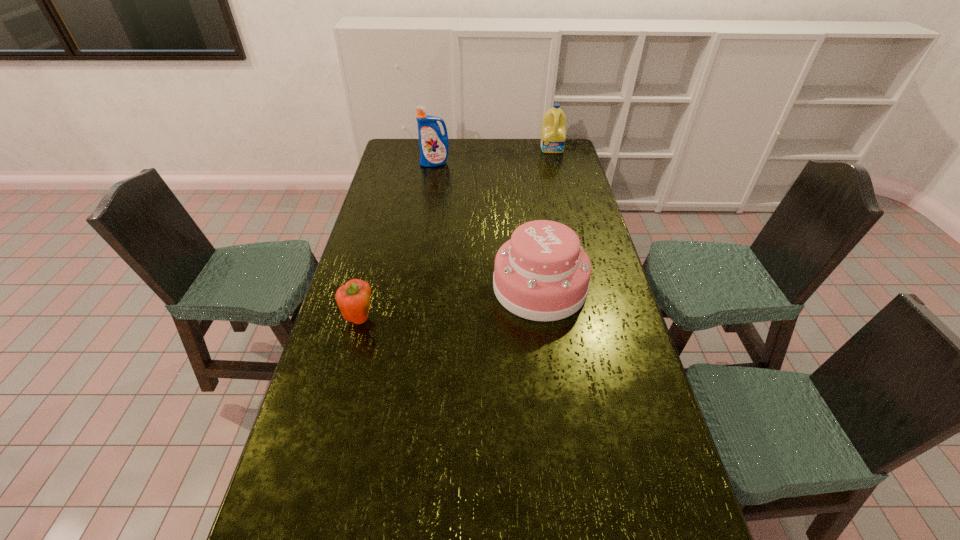
You are a GUI agent. You are given a task and a screenshot of the screen. Output one action in this format:
    pyautogui.click(x=<x>, y=<y>)
    Task: Click on the vacant area that satisfies the following two spatial constraints: 1. on the label of the second farthest object; 2. on the left side of the cake
    This screenshot has width=960, height=540.
    Given the screenshot: What is the action you would take?
    pyautogui.click(x=416, y=287)